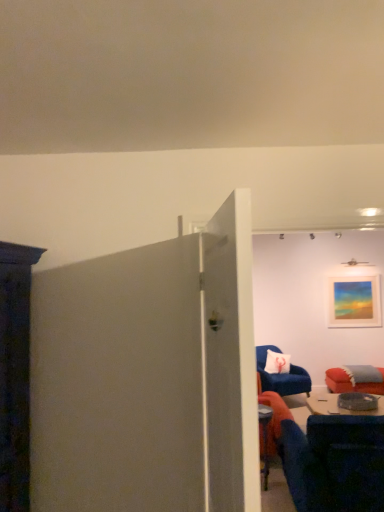
Question: In terms of height, does matte acrylic painting at upper right look taller or shorter compared to white glossy door at center?

Choices:
 (A) short
 (B) tall

Answer: (A)

Question: Choose the correct answer: Is matte acrylic painting at upper right inside white glossy door at center or outside it?

Choices:
 (A) inside
 (B) outside

Answer: (B)

Question: Which of these objects is positioned farthest from the matte acrylic painting at upper right?

Choices:
 (A) velvet blue chair at right, arranged as the 1th chair when viewed from the back
 (B) white glossy door at center
 (C) blue fabric chair at lower right, which appears as the 2th chair when viewed from the back

Answer: (B)

Question: Based on their relative distances, which object is nearer to the blue fabric chair at lower right, the first chair viewed from the front?

Choices:
 (A) white glossy door at center
 (B) velvet blue chair at right, arranged as the 1th chair when viewed from the back
 (C) matte acrylic painting at upper right

Answer: (A)